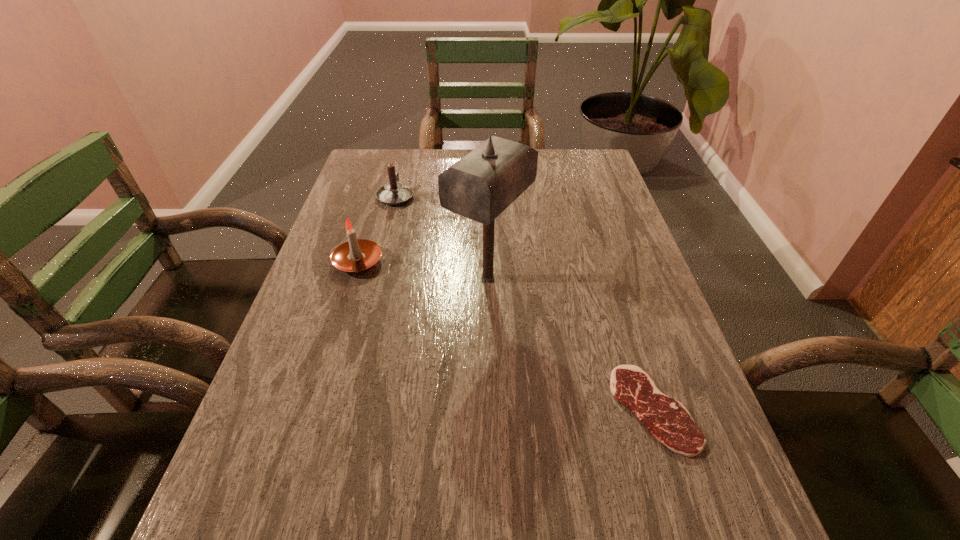
Image resolution: width=960 pixels, height=540 pixels. In order to click on vacant space located 0.070m on the side of the farthest object with the handle loop in this screenshot , I will do [x=401, y=174].

Locate an element on the screen. free space located 0.050m on the side of the farthest object with the handle loop is located at coordinates (400, 177).

Where is `free space located 0.110m on the side of the farthest object with the handle loop`? free space located 0.110m on the side of the farthest object with the handle loop is located at coordinates (403, 168).

Locate an element on the screen. This screenshot has height=540, width=960. free region located on the left of the steak is located at coordinates (573, 409).

The height and width of the screenshot is (540, 960). Identify the location of object located in the right edge section of the desktop. (667, 419).

The height and width of the screenshot is (540, 960). I want to click on vacant space at the far edge of the desktop, so click(422, 166).

In order to click on vacant space at the left edge of the desktop in this screenshot , I will do `click(347, 298)`.

At what (x,y) coordinates should I click in order to perform the action: click on free region at the right edge of the desktop. Please return your answer as a coordinate pair (x, y). This screenshot has height=540, width=960. Looking at the image, I should click on (715, 514).

Image resolution: width=960 pixels, height=540 pixels. In order to click on free region at the far left corner in this screenshot , I will do `click(377, 152)`.

Where is `free space at the far right corner of the desktop`? The image size is (960, 540). free space at the far right corner of the desktop is located at coordinates (557, 156).